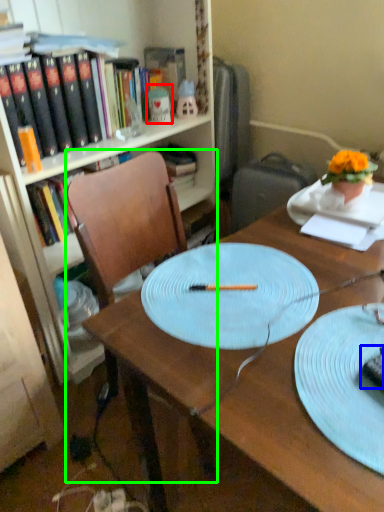
Question: Which object is the closest to the toy (highlighted by a red box)? Choose among these: chocolate cake (highlighted by a blue box) or chair (highlighted by a green box).

Choices:
 (A) chocolate cake
 (B) chair

Answer: (B)